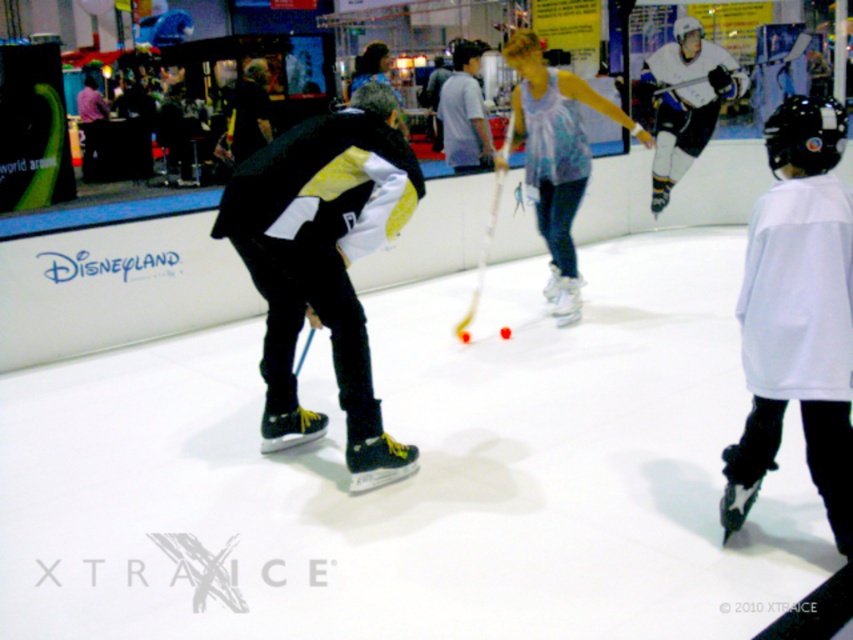
Between point (355, 108) and point (473, 88), which one is positioned behind?

The point (473, 88) is behind.

Which of these two, black matte hockey stick at center or white cotton shirt at center, stands taller?

With more height is black matte hockey stick at center.

Describe the element at coordinates (323, 262) in the screenshot. I see `black matte hockey stick at center` at that location.

The image size is (853, 640). I want to click on black matte hockey stick at center, so click(x=323, y=262).

Is light blue fabric shirt at center to the right of rubber/soft hockey at center from the viewer's perspective?

Correct, you'll find light blue fabric shirt at center to the right of rubber/soft hockey at center.

Can you confirm if light blue fabric shirt at center is shorter than rubber/soft hockey at center?

No, light blue fabric shirt at center is not shorter than rubber/soft hockey at center.

The height and width of the screenshot is (640, 853). Describe the element at coordinates (556, 156) in the screenshot. I see `light blue fabric shirt at center` at that location.

Identify the location of light blue fabric shirt at center. (556, 156).

Does black matte hockey stick at center lie in front of white matte jersey at right?

That is False.

From the picture: Does black matte hockey stick at center have a greater height compared to white matte jersey at right?

Correct, black matte hockey stick at center is much taller as white matte jersey at right.

Who is more distant from viewer, [357,332] or [728,445]?

The point [357,332] is behind.

Locate an element on the screen. This screenshot has width=853, height=640. black matte hockey stick at center is located at coordinates (323, 262).